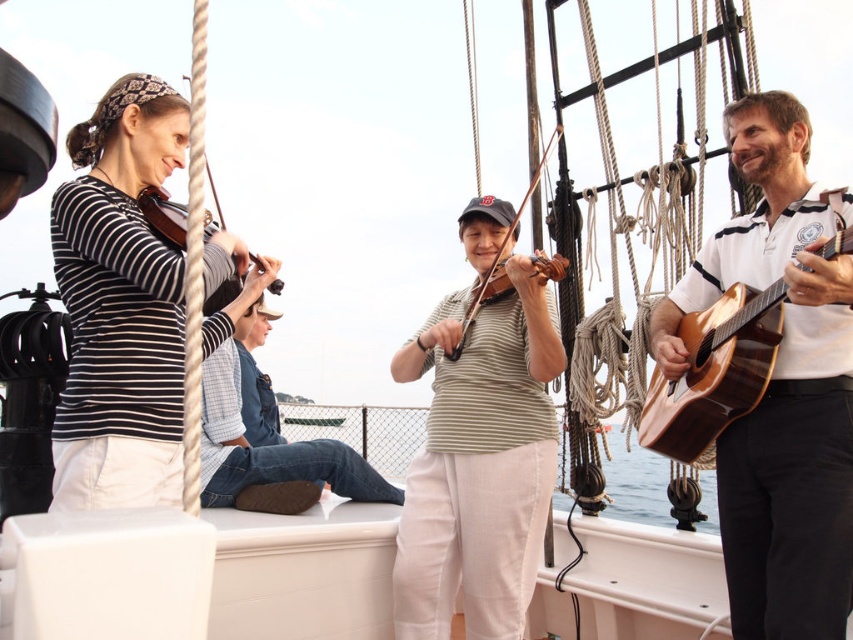
Question: Does matte black violin at left appear on the right side of green striped shirt at center?

Choices:
 (A) yes
 (B) no

Answer: (B)

Question: Is natural wood acoustic guitar at right smaller than wooden violin at center?

Choices:
 (A) no
 (B) yes

Answer: (B)

Question: Estimate the real-world distances between objects in this image. Which object is farther from the wooden acoustic guitar at right?

Choices:
 (A) denim jeans at center
 (B) wooden violin at left
 (C) natural wood acoustic guitar at right
 (D) matte black violin at left

Answer: (D)

Question: Which point is farther from the camera taking this photo?

Choices:
 (A) (705, 419)
 (B) (491, 294)
 (C) (233, 289)
 (D) (415, 496)

Answer: (C)

Question: Which point appears closest to the camera in this image?

Choices:
 (A) (552, 141)
 (B) (102, 152)

Answer: (B)

Question: From the image, what is the correct spatial relationship of matte black violin at left in relation to natural wood acoustic guitar at right?

Choices:
 (A) above
 (B) below

Answer: (A)